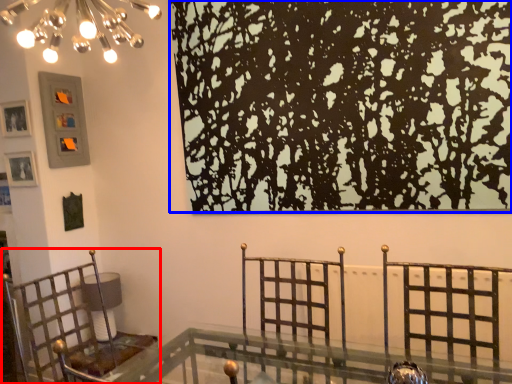
Question: Which object appears closest to the camera in this image, furniture (highlighted by a red box) or tree (highlighted by a blue box)?

Choices:
 (A) furniture
 (B) tree

Answer: (A)